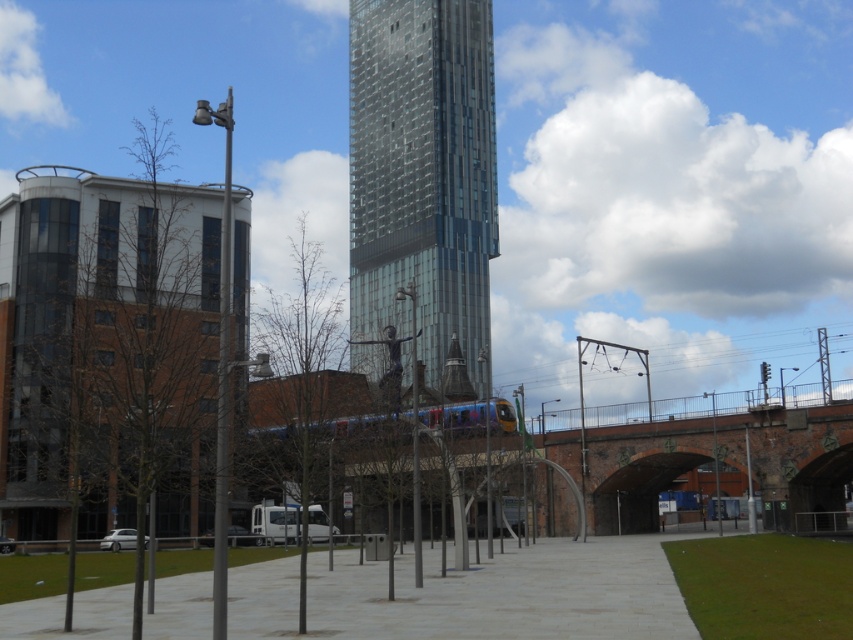
Question: Among these objects, which one is nearest to the camera?

Choices:
 (A) brick archway at center
 (B) glassy metallic skyscraper at center

Answer: (B)

Question: Is glassy metallic skyscraper at center to the right of brick archway at center from the viewer's perspective?

Choices:
 (A) yes
 (B) no

Answer: (B)

Question: Which point is closer to the camera?

Choices:
 (A) (677, 435)
 (B) (444, 4)

Answer: (A)

Question: Does glassy metallic skyscraper at center have a lesser width compared to brick archway at center?

Choices:
 (A) yes
 (B) no

Answer: (B)

Question: Is glassy metallic skyscraper at center positioned in front of brick archway at center?

Choices:
 (A) no
 (B) yes

Answer: (B)